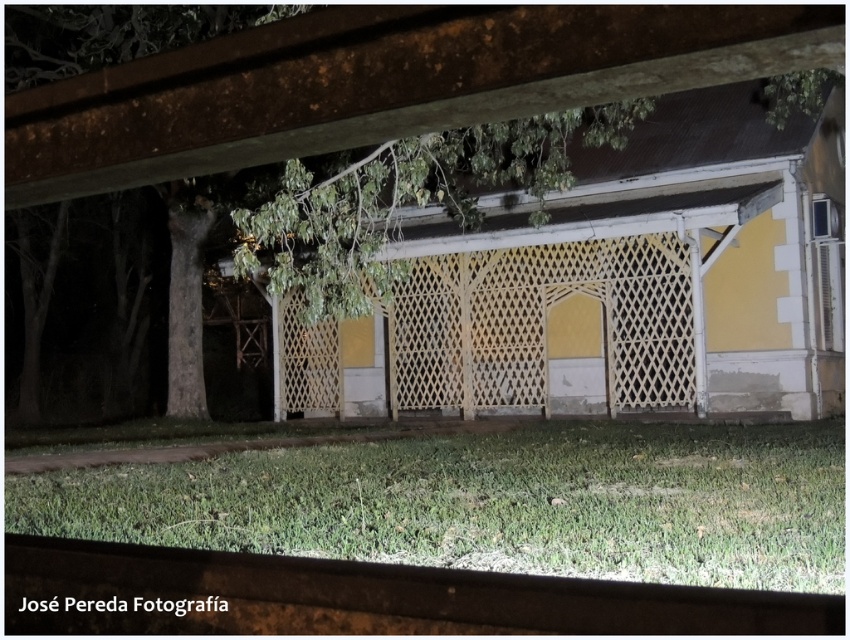
Question: Can you confirm if green grass at lower center is positioned to the right of green leafy tree at center?

Choices:
 (A) yes
 (B) no

Answer: (A)

Question: Among these objects, which one is nearest to the camera?

Choices:
 (A) white lattice fence at center
 (B) yellow lattice fence at center
 (C) green grass at lower center
 (D) green leafy tree at center

Answer: (D)

Question: Is green grass at lower center further to the viewer compared to white lattice fence at center?

Choices:
 (A) no
 (B) yes

Answer: (A)

Question: Which point is farther to the camera?

Choices:
 (A) green leafy tree at center
 (B) yellow lattice fence at center
 (C) white lattice fence at center
 (D) green grass at lower center

Answer: (C)

Question: Where is yellow lattice fence at center located in relation to white lattice fence at center in the image?

Choices:
 (A) above
 (B) below

Answer: (A)

Question: Considering the real-world distances, which object is farthest from the green leafy tree at center?

Choices:
 (A) green grass at lower center
 (B) yellow lattice fence at center
 (C) white lattice fence at center

Answer: (A)